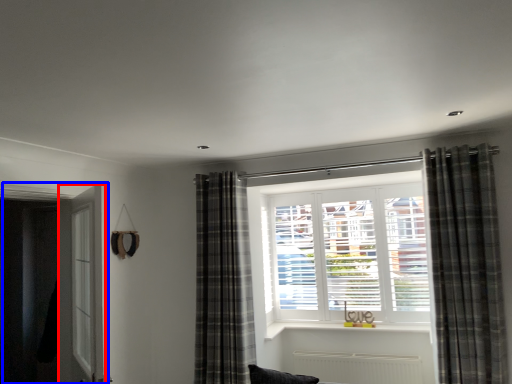
Question: Among these objects, which one is farthest to the camera, screen door (highlighted by a red box) or door (highlighted by a blue box)?

Choices:
 (A) screen door
 (B) door

Answer: (B)